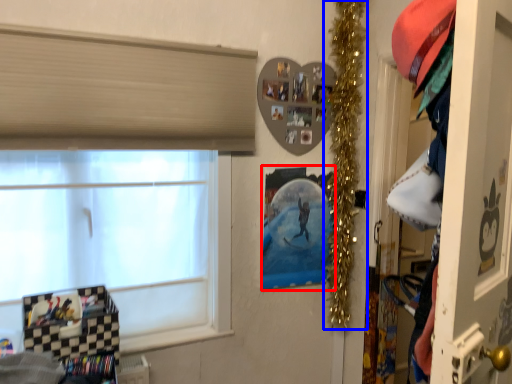
Question: Which point is further to the camera, picture frame (highlighted by a red box) or christmas decoration (highlighted by a blue box)?

Choices:
 (A) picture frame
 (B) christmas decoration

Answer: (A)